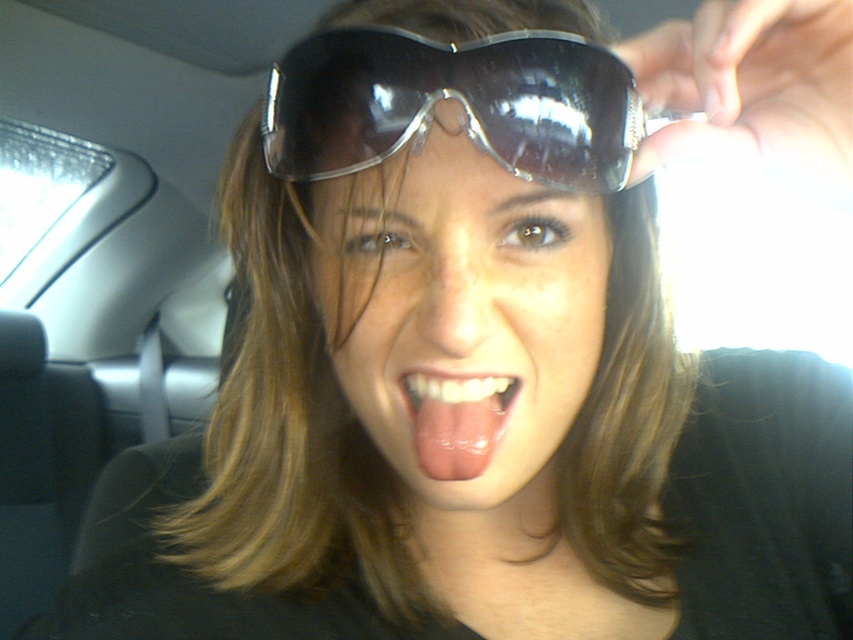
Question: Estimate the real-world distances between objects in this image. Which object is farther from the glossy plastic sunglasses at center?

Choices:
 (A) shiny black goggles at center
 (B) pink glossy tongue at center

Answer: (A)

Question: Is glossy plastic sunglasses at center thinner than pink glossy tongue at center?

Choices:
 (A) yes
 (B) no

Answer: (B)

Question: Which object appears closest to the camera in this image?

Choices:
 (A) glossy plastic sunglasses at center
 (B) pink glossy tongue at center
 (C) shiny black goggles at center

Answer: (C)

Question: Where is glossy plastic sunglasses at center located in relation to shiny black goggles at center in the image?

Choices:
 (A) left
 (B) right

Answer: (A)

Question: Among these objects, which one is nearest to the camera?

Choices:
 (A) glossy plastic sunglasses at center
 (B) pink glossy tongue at center

Answer: (A)

Question: Is shiny black goggles at center further to the viewer compared to pink glossy tongue at center?

Choices:
 (A) no
 (B) yes

Answer: (A)